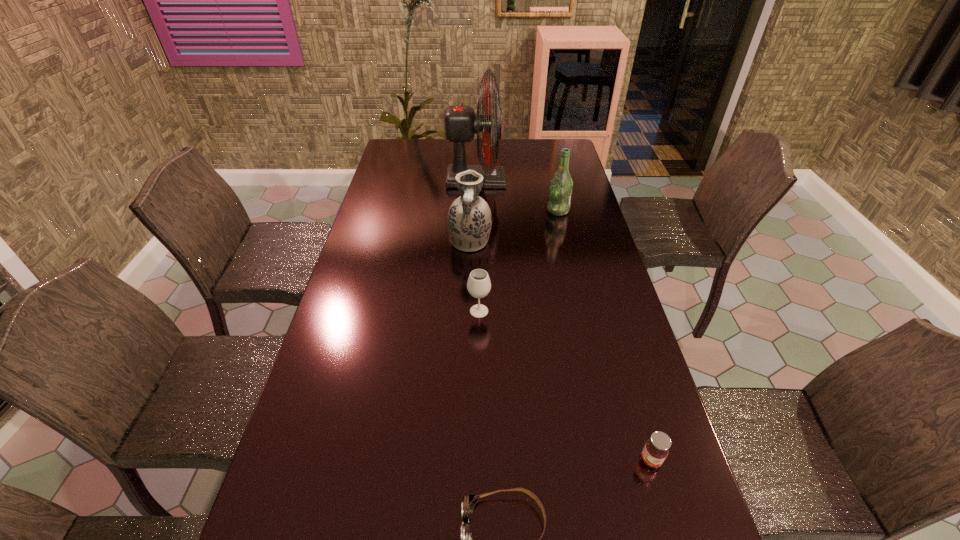
Identify the location of the tallest object. (461, 123).

You are a GUI agent. You are given a task and a screenshot of the screen. Output one action in this format:
    pyautogui.click(x=<x>, y=<y>)
    Task: Click on the vase
    
    Given the screenshot: What is the action you would take?
    pyautogui.click(x=469, y=219)

Locate an element on the screen. The width and height of the screenshot is (960, 540). beer bottle is located at coordinates (561, 185).

At what (x,y) coordinates should I click in order to perform the action: click on the fourth tallest object. Please return your answer as a coordinate pair (x, y). Looking at the image, I should click on (478, 285).

Where is `wineglass`? This screenshot has width=960, height=540. wineglass is located at coordinates (478, 285).

Find the location of a particular element. The width and height of the screenshot is (960, 540). jam is located at coordinates (655, 451).

Where is `the fifth tallest object`? This screenshot has width=960, height=540. the fifth tallest object is located at coordinates (655, 451).

The height and width of the screenshot is (540, 960). Find the location of `free space located 0.120m on the front-facing side of the tallest object`. free space located 0.120m on the front-facing side of the tallest object is located at coordinates (534, 180).

Identify the location of free location located with the handle on the side of the vase. (468, 322).

Find the location of a particular element. This screenshot has height=540, width=960. vacant region located 0.050m on the surface of the beer bottle is located at coordinates (534, 211).